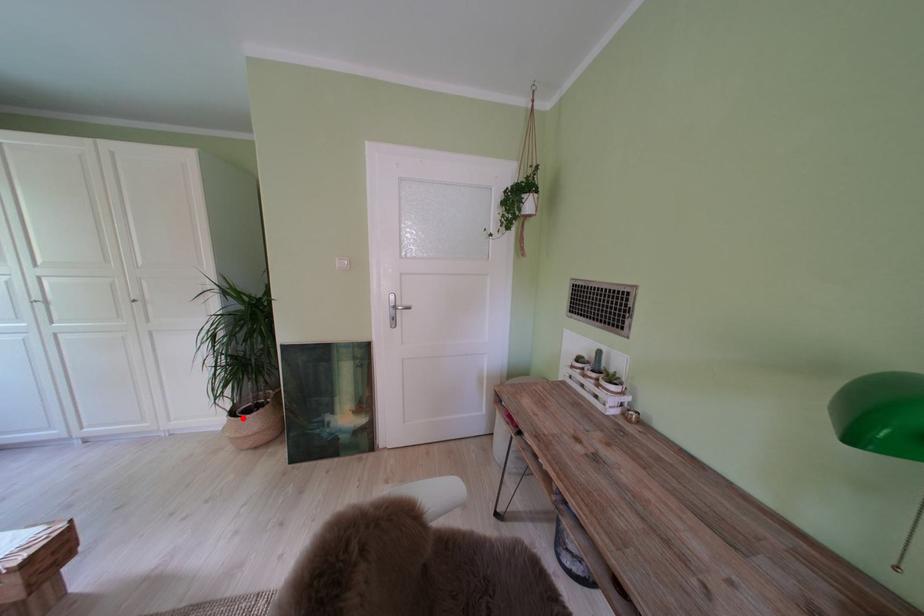
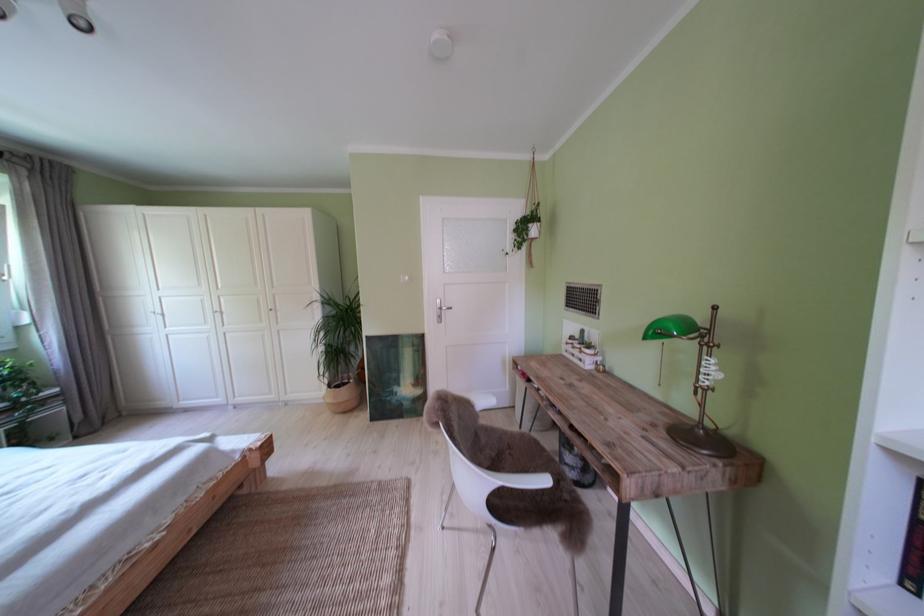
Question: I am providing you with two images of the same scene from different viewpoints. In image1, a red point is highlighted. Considering the same 3D point in image2, which of the following is correct?

Choices:
 (A) It is closer
 (B) It is farther

Answer: (A)